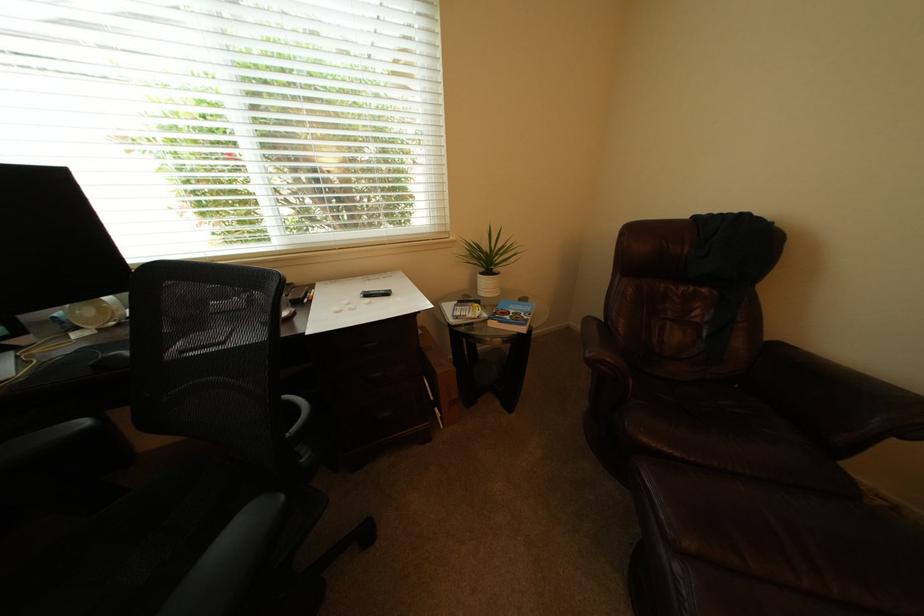
This screenshot has width=924, height=616. Identify the location of brown leather sitting surface. (699, 421).